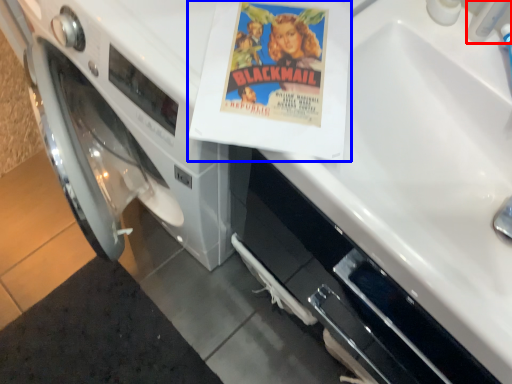
Question: Which of the following is the farthest to the observer, faucet (highlighted by a red box) or paperback book (highlighted by a blue box)?

Choices:
 (A) faucet
 (B) paperback book

Answer: (B)